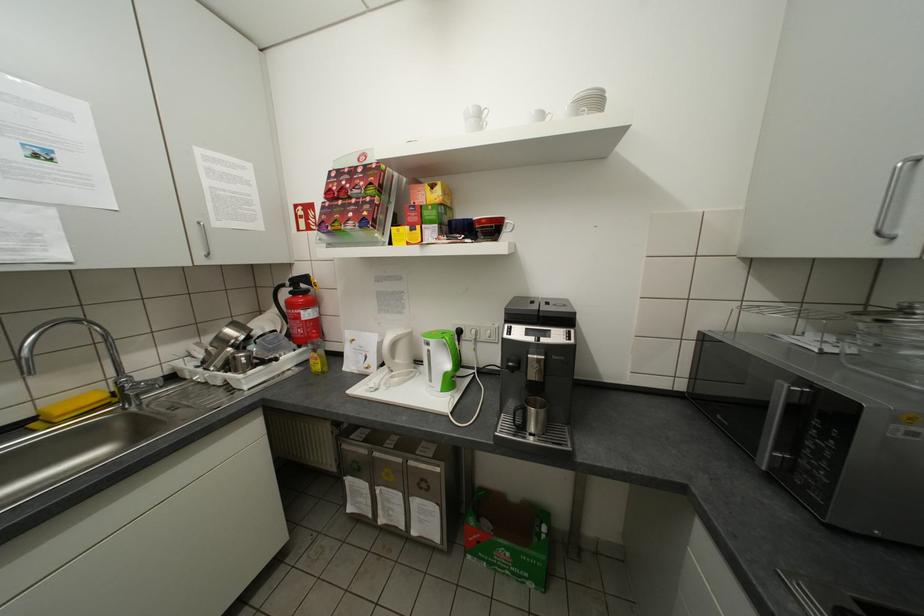
In order to click on white kettle handle in this screenshot , I will do `click(397, 355)`.